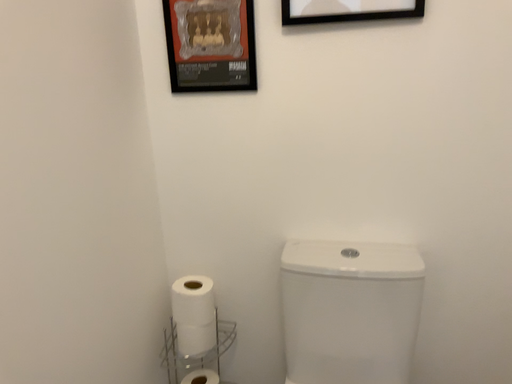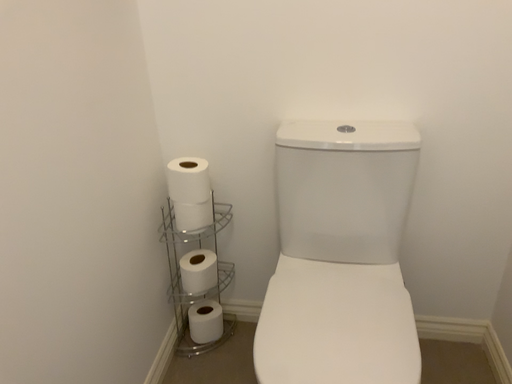
Question: Which way did the camera rotate in the video?

Choices:
 (A) rotated downward
 (B) rotated upward

Answer: (A)